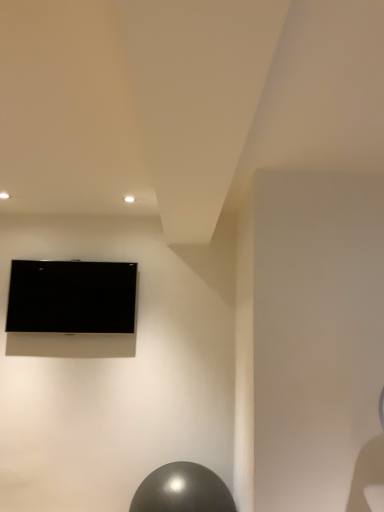
Question: From the image's perspective, is glossy metallic ball at lower center located above or below black glossy tv at upper left?

Choices:
 (A) above
 (B) below

Answer: (B)

Question: In terms of height, does glossy metallic ball at lower center look taller or shorter compared to black glossy tv at upper left?

Choices:
 (A) tall
 (B) short

Answer: (B)

Question: Considering the relative positions of glossy metallic ball at lower center and black glossy tv at upper left in the image provided, is glossy metallic ball at lower center to the left or to the right of black glossy tv at upper left?

Choices:
 (A) left
 (B) right

Answer: (B)

Question: Is black glossy tv at upper left taller or shorter than glossy metallic ball at lower center?

Choices:
 (A) tall
 (B) short

Answer: (A)

Question: From a real-world perspective, is black glossy tv at upper left above or below glossy metallic ball at lower center?

Choices:
 (A) above
 (B) below

Answer: (A)

Question: From the image's perspective, relative to glossy metallic ball at lower center, is black glossy tv at upper left above or below?

Choices:
 (A) above
 (B) below

Answer: (A)

Question: Is black glossy tv at upper left situated inside glossy metallic ball at lower center or outside?

Choices:
 (A) outside
 (B) inside

Answer: (A)